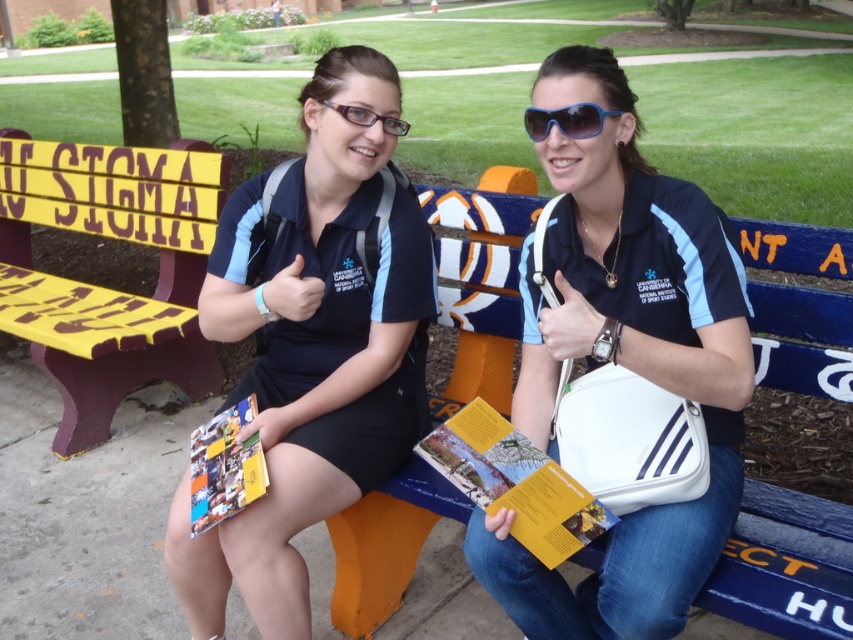
Does white synthetic bag at center have a lesser width compared to yellow painted wood bench at upper left?

Correct, white synthetic bag at center's width is less than yellow painted wood bench at upper left's.

Find the location of a particular element. This screenshot has height=640, width=853. white synthetic bag at center is located at coordinates (624, 358).

From the picture: Who is positioned more to the left, yellow painted wood bench at upper left or yellow paper brochure at center?

From the viewer's perspective, yellow painted wood bench at upper left appears more on the left side.

Is yellow painted wood bench at upper left below yellow paper brochure at center?

No.

Where is `yellow painted wood bench at upper left`? yellow painted wood bench at upper left is located at coordinates (119, 300).

The width and height of the screenshot is (853, 640). In order to click on yellow painted wood bench at upper left in this screenshot , I will do `click(119, 300)`.

Is point (538, 113) positioned behind point (361, 116)?

No, it is not.

The image size is (853, 640). I want to click on blue plastic sunglasses at center, so click(566, 120).